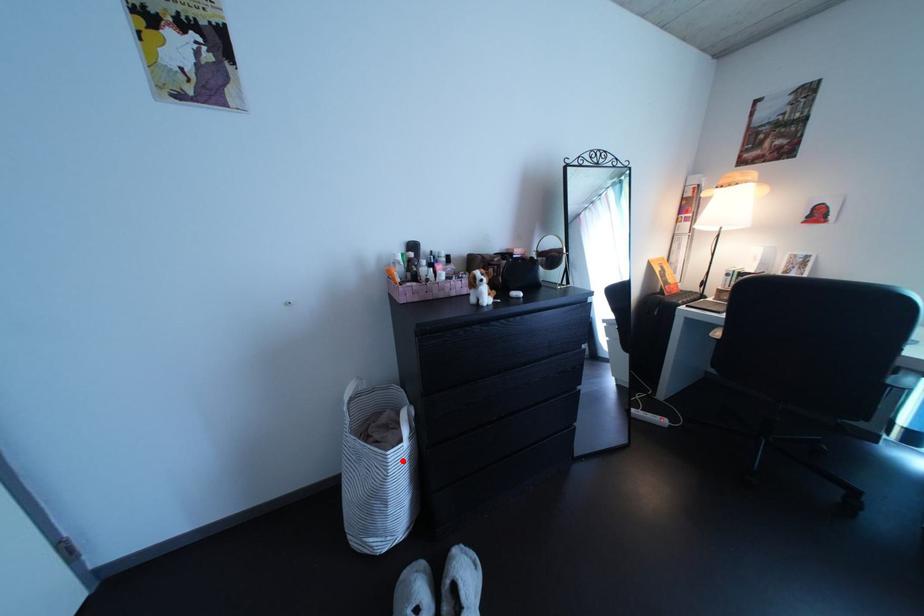
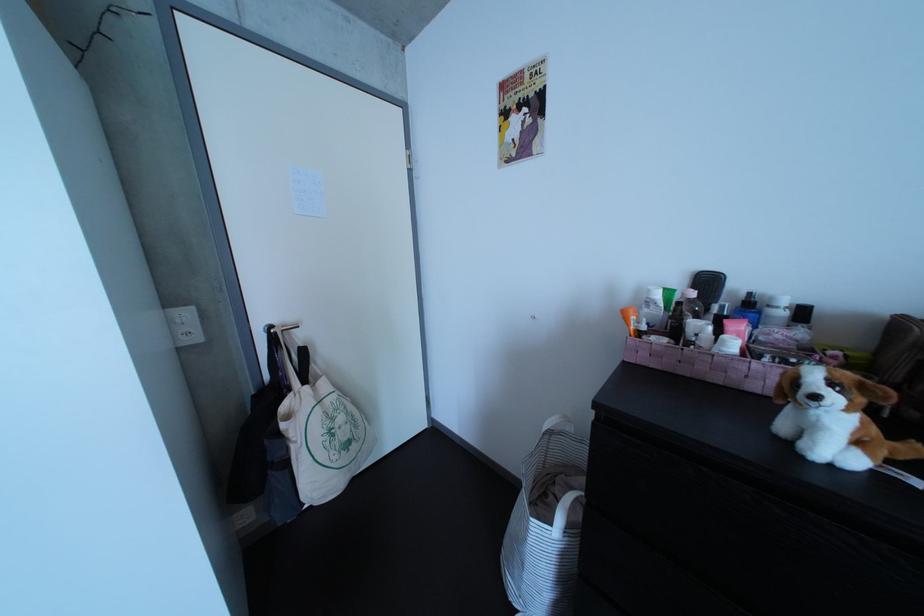
Question: A red point is marked in image1. In image2, is the corresponding 3D point closer to the camera or farther? Reply with the corresponding letter.

Choices:
 (A) The corresponding 3D point is closer.
 (B) The corresponding 3D point is farther.

Answer: (A)